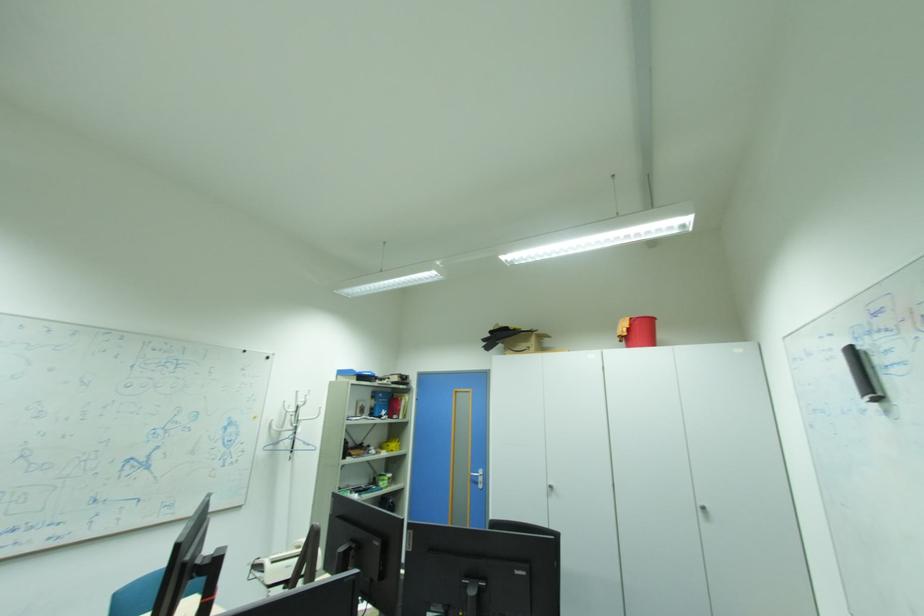
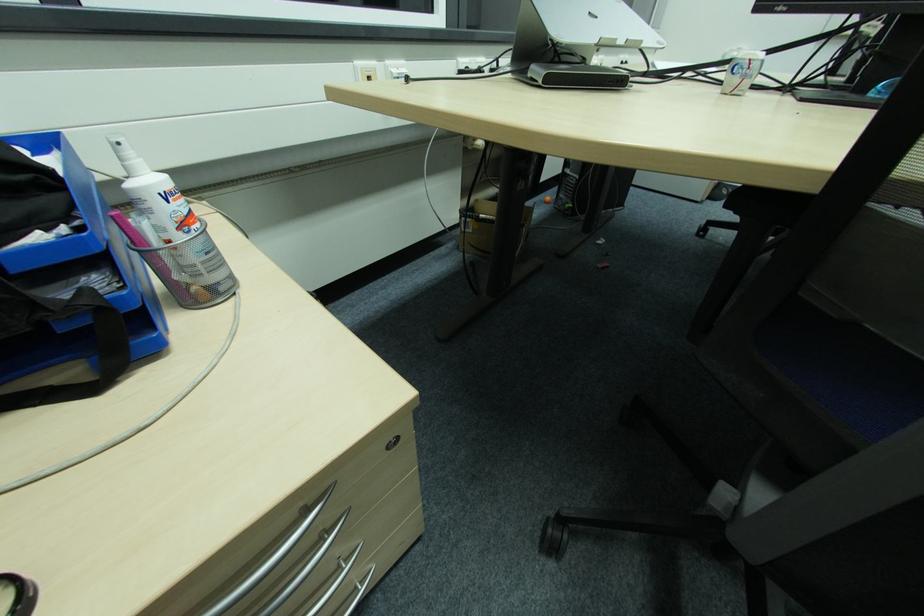
Based on the continuous images, in which direction is the camera rotating?

The camera's rotation is toward left-down.